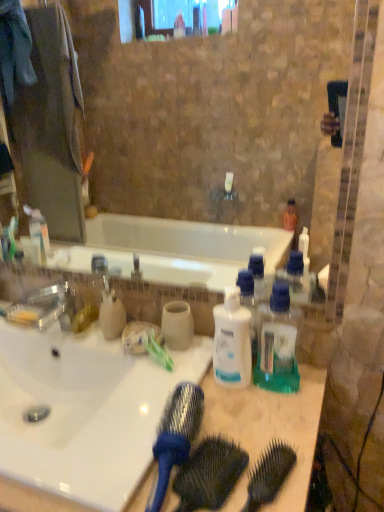
This screenshot has height=512, width=384. Find the location of `vacant space behind black plastic brush at center, marked as the second brush in a left-to-right arrangement`. vacant space behind black plastic brush at center, marked as the second brush in a left-to-right arrangement is located at coordinates (251, 422).